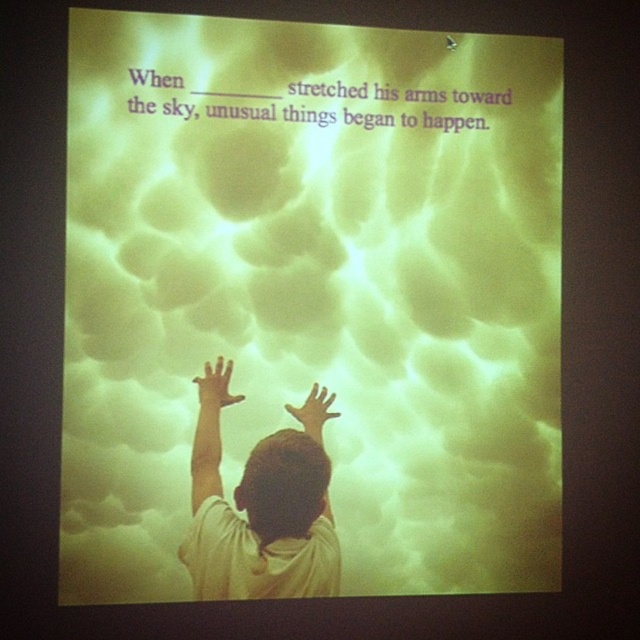
Question: Which object is the farthest from the matte yellow hand at center?

Choices:
 (A) white matte cloud at upper center
 (B) white matte shirt at lower center

Answer: (A)

Question: Does matte yellow hand at upper center appear over matte yellow hand at center?

Choices:
 (A) no
 (B) yes

Answer: (B)

Question: Which of the following is the closest to the observer?

Choices:
 (A) matte yellow hand at upper center
 (B) white matte shirt at lower center
 (C) matte yellow hand at center
 (D) white matte cloud at upper center

Answer: (D)

Question: Estimate the real-world distances between objects in this image. Which object is closer to the white matte cloud at upper center?

Choices:
 (A) matte yellow hand at center
 (B) matte yellow hand at upper center
 (C) white matte shirt at lower center

Answer: (C)

Question: Does white matte cloud at upper center have a greater width compared to matte yellow hand at center?

Choices:
 (A) no
 (B) yes

Answer: (B)

Question: Can you confirm if white matte cloud at upper center is smaller than white matte shirt at lower center?

Choices:
 (A) yes
 (B) no

Answer: (B)